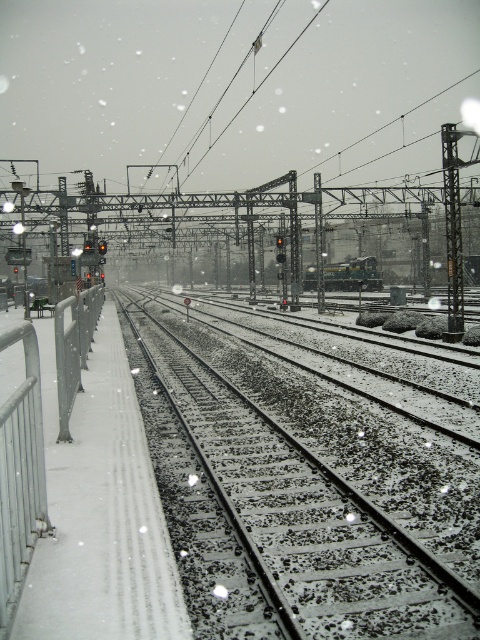
Question: Which of the following is the closest to the observer?

Choices:
 (A) snow-covered tracks at center
 (B) green matte train at center

Answer: (A)

Question: Does snow-covered tracks at center lie in front of green matte train at center?

Choices:
 (A) no
 (B) yes

Answer: (B)

Question: Observing the image, what is the correct spatial positioning of snow-covered tracks at center in reference to green matte train at center?

Choices:
 (A) below
 (B) above

Answer: (A)

Question: Can you confirm if snow-covered tracks at center is positioned to the left of green matte train at center?

Choices:
 (A) no
 (B) yes

Answer: (B)